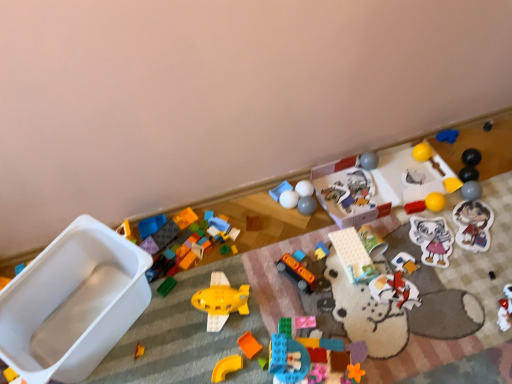
Locate an element on the screen. free space that is in between orange plastic block at lower left, acting as the 23th toy starting from the right, and matte gray ball at right, the 2th toy from the right is located at coordinates (322, 267).